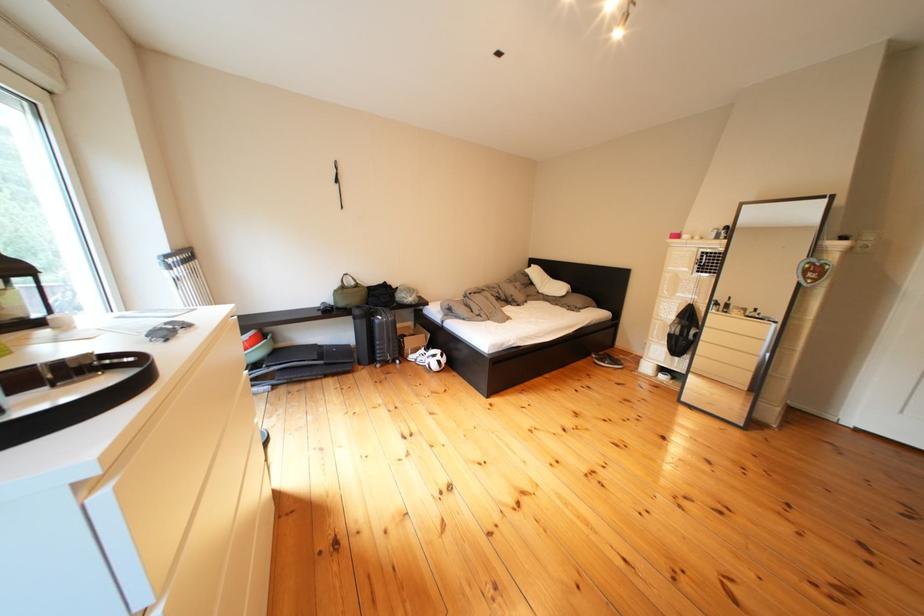
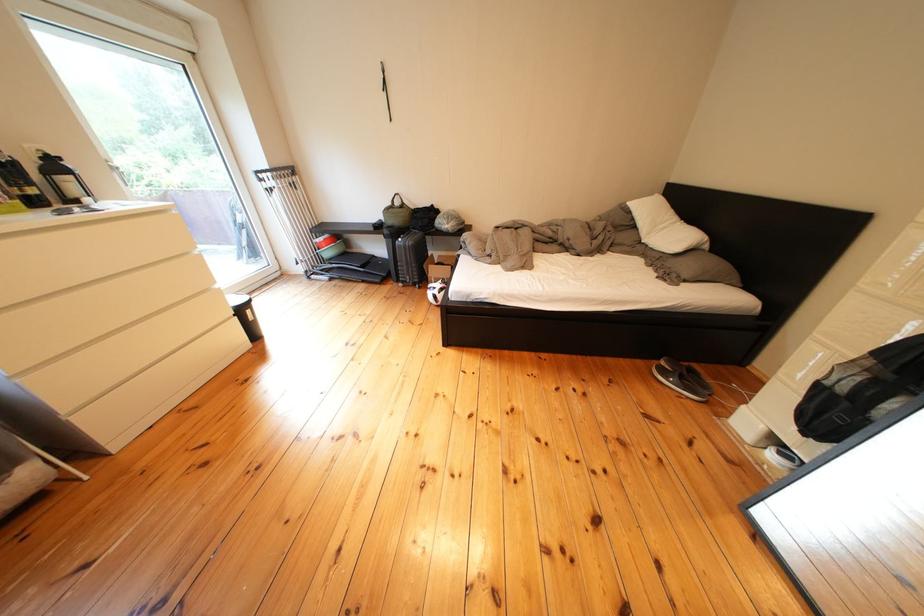
In the second image, find the point that corresponds to [371,317] in the first image.

(399, 236)